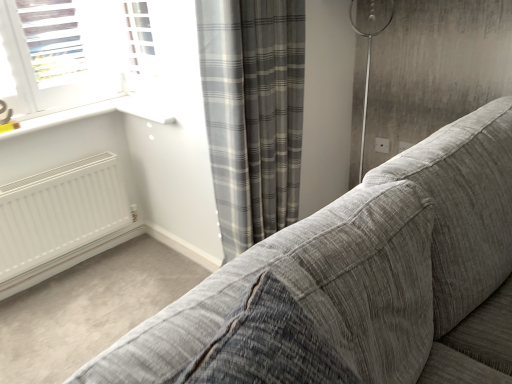
Question: Considering the relative sizes of matte gray outlet at upper center and textured gray fabric couch at center in the image provided, is matte gray outlet at upper center bigger than textured gray fabric couch at center?

Choices:
 (A) yes
 (B) no

Answer: (B)

Question: From a real-world perspective, is matte gray outlet at upper center physically above textured gray fabric couch at center?

Choices:
 (A) yes
 (B) no

Answer: (B)

Question: Is matte gray outlet at upper center taller than textured gray fabric couch at center?

Choices:
 (A) no
 (B) yes

Answer: (A)

Question: Is the position of matte gray outlet at upper center less distant than that of textured gray fabric couch at center?

Choices:
 (A) yes
 (B) no

Answer: (B)

Question: From the image's perspective, would you say matte gray outlet at upper center is positioned over textured gray fabric couch at center?

Choices:
 (A) yes
 (B) no

Answer: (A)

Question: Is the position of matte gray outlet at upper center more distant than that of textured gray fabric couch at center?

Choices:
 (A) no
 (B) yes

Answer: (B)

Question: Considering the relative sizes of gray plaid curtain at center and matte gray outlet at upper center in the image provided, is gray plaid curtain at center taller than matte gray outlet at upper center?

Choices:
 (A) yes
 (B) no

Answer: (A)

Question: Does gray plaid curtain at center touch matte gray outlet at upper center?

Choices:
 (A) yes
 (B) no

Answer: (B)

Question: Does gray plaid curtain at center have a larger size compared to matte gray outlet at upper center?

Choices:
 (A) no
 (B) yes

Answer: (B)

Question: Does gray plaid curtain at center appear on the left side of matte gray outlet at upper center?

Choices:
 (A) yes
 (B) no

Answer: (A)

Question: Does gray plaid curtain at center appear on the right side of matte gray outlet at upper center?

Choices:
 (A) yes
 (B) no

Answer: (B)

Question: Considering the relative sizes of gray plaid curtain at center and matte gray outlet at upper center in the image provided, is gray plaid curtain at center shorter than matte gray outlet at upper center?

Choices:
 (A) yes
 (B) no

Answer: (B)

Question: Does textured gray fabric couch at center contain matte gray outlet at upper center?

Choices:
 (A) no
 (B) yes

Answer: (A)